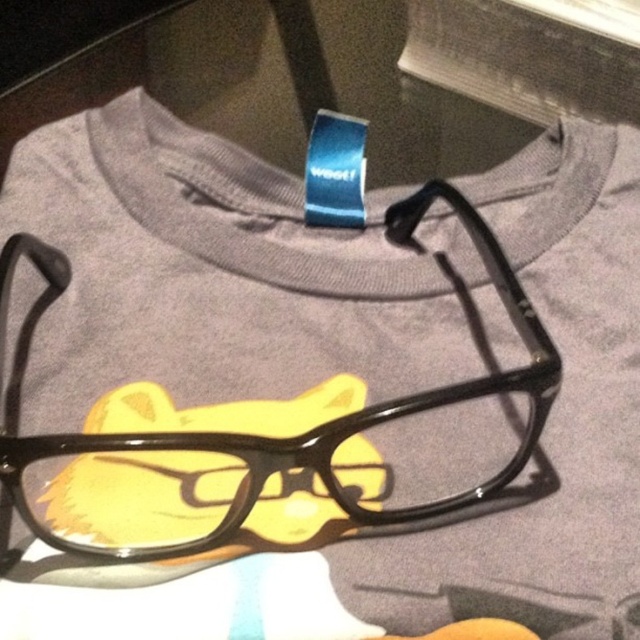
You are trying to decide whether to place a small sticker on the T shirt. The sticker is exactly the size of the yellow plush cat at center. Will the sticker fit entirely within the remaining space not covered by the black shiny glasses at center?

The black shiny glasses at center is bigger than yellow plush cat at center. Since the sticker is the same size as the yellow plush cat at center, it may not fit entirely within the remaining space because the glasses are larger and might block part of the available area.

You are trying to place a new sticker on the gray T shirt. The sticker is exactly the same size as the yellow plush cat at center. Will the sticker fit without overlapping the black shiny glasses at center?

The black shiny glasses at center is wider than the yellow plush cat at center. Since the sticker is the same size as the yellow plush cat at center, it can be placed on the T shirt without overlapping the black shiny glasses at center if positioned appropriately.